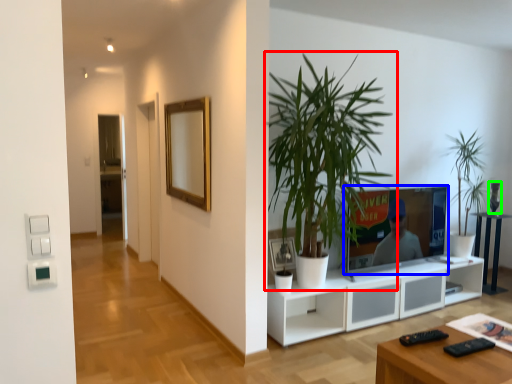
Question: Which object is positioned closest to houseplant (highlighted by a red box)? Select from television (highlighted by a blue box) and vase (highlighted by a green box).

Choices:
 (A) television
 (B) vase

Answer: (A)